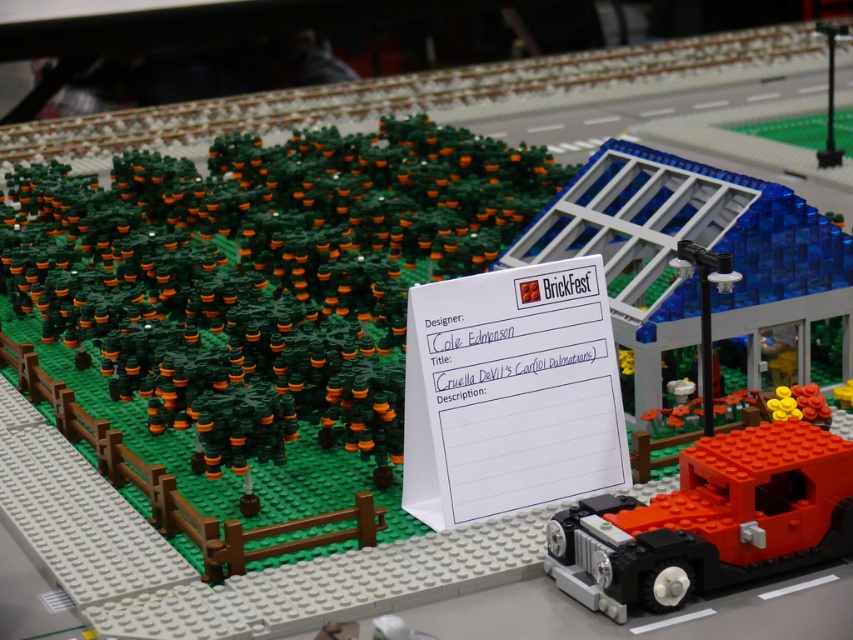
Question: Does green matte trees at upper left appear under brick red car at lower right?

Choices:
 (A) yes
 (B) no

Answer: (B)

Question: Is green matte trees at upper left smaller than brick red car at lower right?

Choices:
 (A) no
 (B) yes

Answer: (A)

Question: Which of the following is the closest to the observer?

Choices:
 (A) brick red car at lower right
 (B) green matte trees at upper left

Answer: (A)

Question: Which of the following is the farthest from the observer?

Choices:
 (A) (271, 372)
 (B) (700, 577)

Answer: (A)

Question: Can you confirm if green matte trees at upper left is positioned to the left of brick red car at lower right?

Choices:
 (A) no
 (B) yes

Answer: (B)